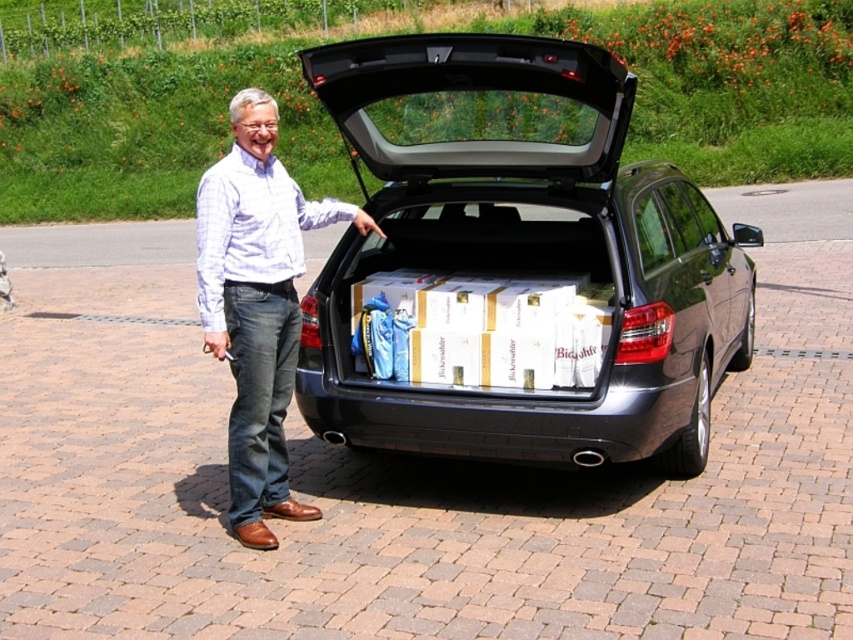
Does satin black car at center have a lesser height compared to light blue plaid shirt at center?

No, satin black car at center is not shorter than light blue plaid shirt at center.

Does satin black car at center have a greater width compared to light blue plaid shirt at center?

Yes, satin black car at center is wider than light blue plaid shirt at center.

Is point (534, 156) less distant than point (268, 196)?

No, it is not.

Identify the location of satin black car at center. (515, 262).